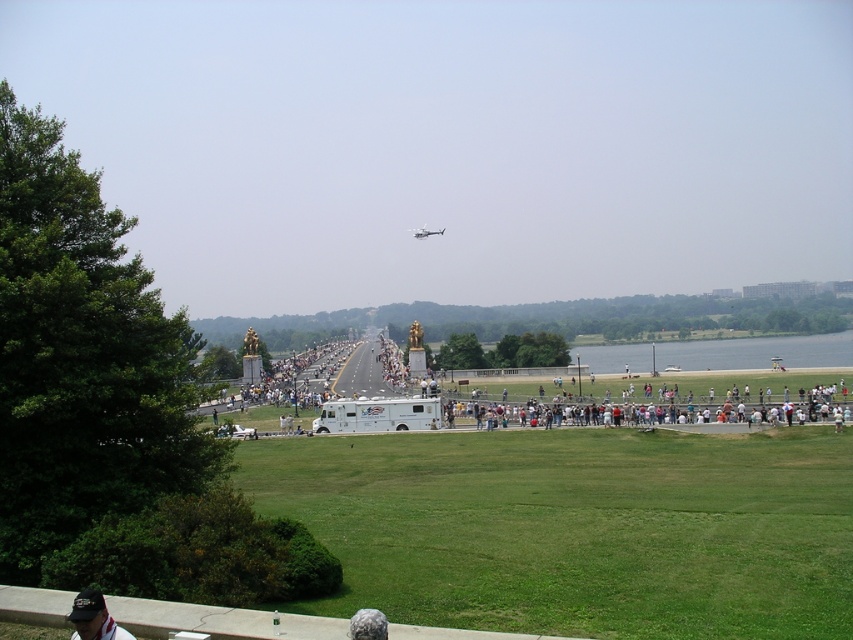
You are a photographer standing at the edge of the grassy area near the concrete barrier. You want to capture a photo of the white van at center and the metallic silver helicopter at center from your current position. Which object will appear closer to the bottom edge of your photo?

The white van at center is positioned under the metallic silver helicopter at center, so in the photo, the white van at center will appear closer to the bottom edge of the photo than the metallic silver helicopter at center.

You are standing at the concrete barrier in the foreground of the scene. You see a point marked at coordinates (756, 353). What object is located at that point?

The point at coordinates (756, 353) marks the white van at center.